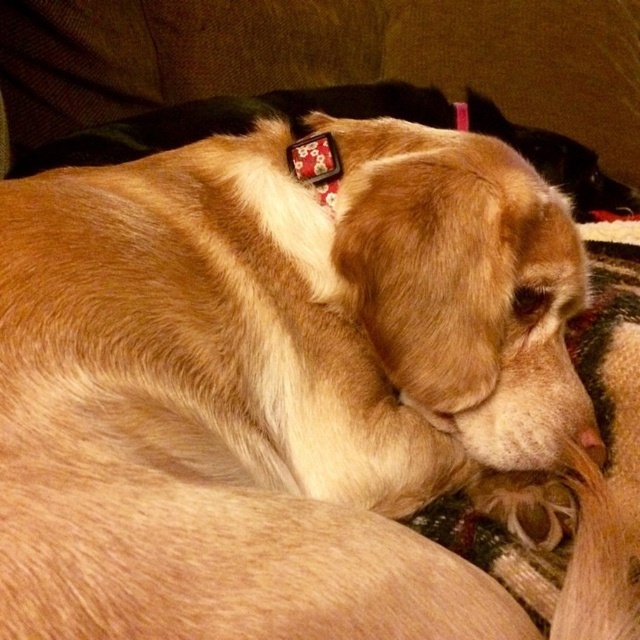
Is fuzzy fabric dog bed at center thinner than floral fabric collar at upper center?

In fact, fuzzy fabric dog bed at center might be wider than floral fabric collar at upper center.

Image resolution: width=640 pixels, height=640 pixels. Find the location of `fuzzy fabric dog bed at center`. fuzzy fabric dog bed at center is located at coordinates (612, 356).